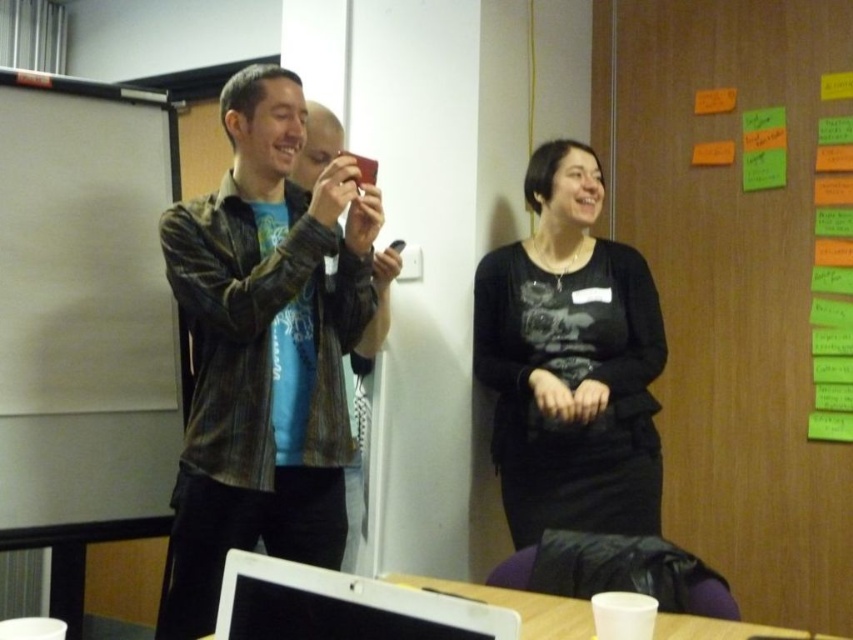
Who is more forward, (350, 273) or (288, 609)?

Positioned in front is point (288, 609).

Which is more to the right, leather jacket at center or white glossy laptop at lower center?

From the viewer's perspective, white glossy laptop at lower center appears more on the right side.

Is point (306, 458) positioned after point (386, 589)?

Yes, it is behind point (386, 589).

The width and height of the screenshot is (853, 640). I want to click on leather jacket at center, so tap(264, 348).

Does leather jacket at center have a larger size compared to white plastic cup at lower center?

Yes, leather jacket at center is bigger than white plastic cup at lower center.

Who is more forward, [219,193] or [524,628]?

Point [524,628] is more forward.

Where is `leather jacket at center`? This screenshot has width=853, height=640. leather jacket at center is located at coordinates [x=264, y=348].

Does point (4, 298) come behind point (520, 637)?

Yes, point (4, 298) is behind point (520, 637).

Does white matte projector screen at left lie in front of white plastic cup at lower center?

No, it is behind white plastic cup at lower center.

Where is `white matte projector screen at left`? This screenshot has width=853, height=640. white matte projector screen at left is located at coordinates tap(84, 305).